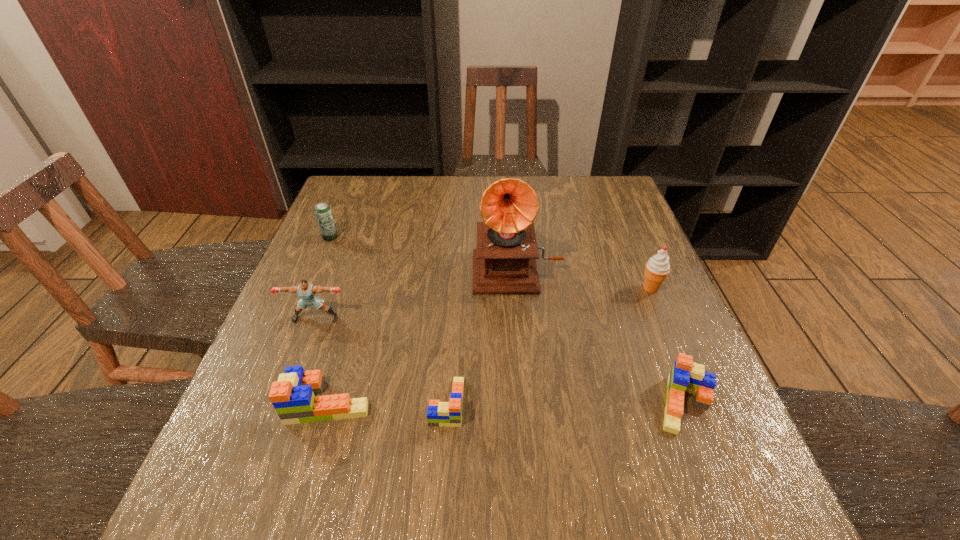
In order to click on the leftmost Lego in this screenshot , I will do `click(292, 396)`.

Where is `the fourth object from left to right`? The width and height of the screenshot is (960, 540). the fourth object from left to right is located at coordinates (445, 414).

Locate an element on the screen. the shortest object is located at coordinates (445, 414).

Locate an element on the screen. This screenshot has height=540, width=960. the second shortest Lego is located at coordinates (687, 376).

You are a GUI agent. You are given a task and a screenshot of the screen. Output one action in this format:
    pyautogui.click(x=<x>, y=<y>)
    Task: Click on the rightmost Lego
    This screenshot has height=540, width=960.
    Given the screenshot: What is the action you would take?
    pyautogui.click(x=687, y=376)

You are a GUI agent. You are given a task and a screenshot of the screen. Output one action in this format:
    pyautogui.click(x=<x>, y=<y>)
    Task: Click on the beer can
    The width and height of the screenshot is (960, 540).
    Given the screenshot: What is the action you would take?
    (323, 213)

Find the location of `phonograph record`. phonograph record is located at coordinates (504, 262).

The image size is (960, 540). I want to click on the third object from right to left, so click(504, 262).

You are a GUI agent. You are given a task and a screenshot of the screen. Output one action in this format:
    pyautogui.click(x=<x>, y=<y>)
    Task: Click on the puncher
    
    Given the screenshot: What is the action you would take?
    pyautogui.click(x=306, y=291)

At what (x,y) coordinates should I click in order to perform the action: click on icecream. Please return your answer as a coordinate pair (x, y). Looking at the image, I should click on click(x=657, y=268).